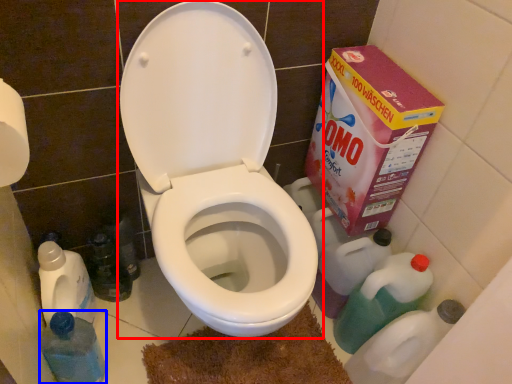
Question: Which of the following is the closest to the observer, toilet (highlighted by a red box) or bottle (highlighted by a blue box)?

Choices:
 (A) toilet
 (B) bottle

Answer: (A)